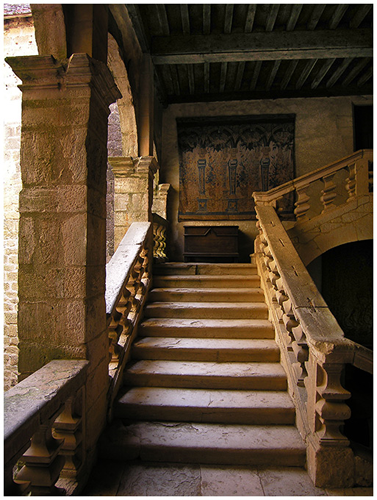
This screenshot has height=500, width=377. I want to click on floor, so click(x=145, y=480), click(x=258, y=478).